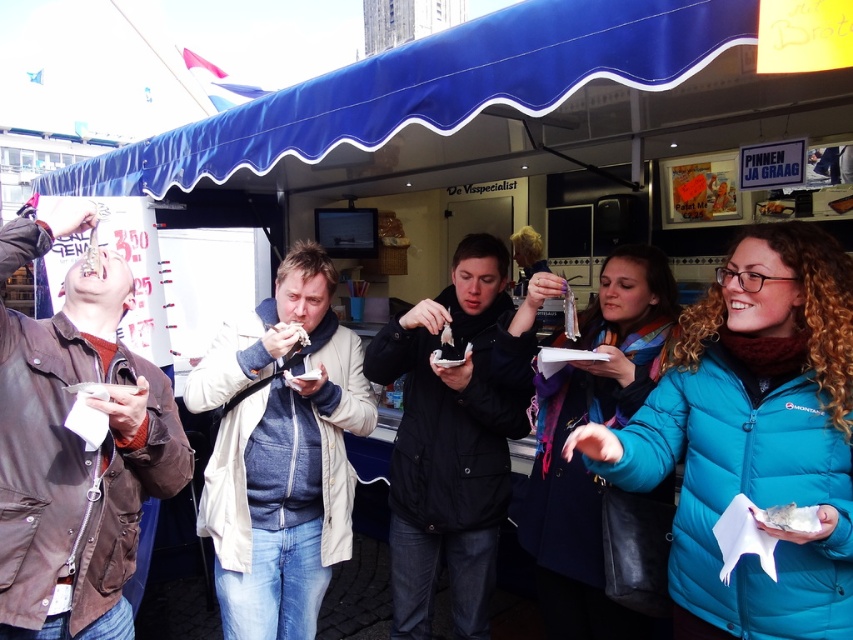
You are a photographer trying to capture both the brown leather jacket at left and the white paper food at lower right in a single shot. Which object should you focus on first to ensure both are in frame without moving the camera?

The brown leather jacket at left is bigger than the white paper food at lower right, so you should focus on the brown leather jacket at left first to ensure both are in frame without moving the camera.

From the picture: You are a customer at the food stall under the blue awning. You see a shiny silver spoon at center and a shiny silver fish at center. Which object is positioned higher in the image?

The shiny silver spoon at center is located above the shiny silver fish at center, so the spoon is positioned higher.

Based on the photo, you are a photographer trying to capture a shot of both the brown leather jacket at left and the white paper food at lower right. Since you want both subjects to be clearly visible in the frame, which object should you focus on first to ensure proper depth of field?

The brown leather jacket at left is taller than the white paper food at lower right, so focusing on the brown leather jacket at left first will help ensure both are in focus due to its greater height.